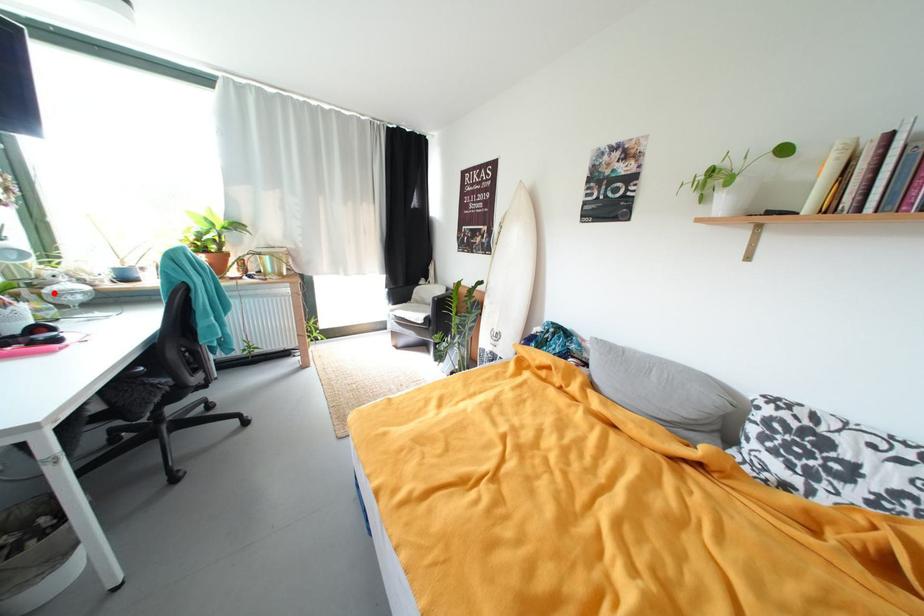
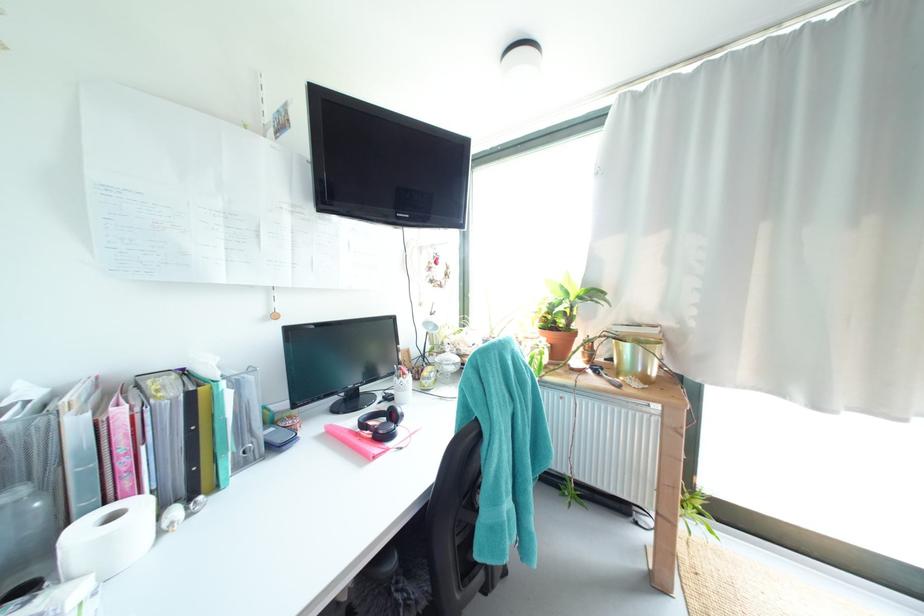
Question: I am providing you with two images of the same scene from different viewpoints. A red point is marked on the first image. At the location where the point appears in image 1, is it still visible in image 2?

Choices:
 (A) Yes
 (B) No

Answer: (A)